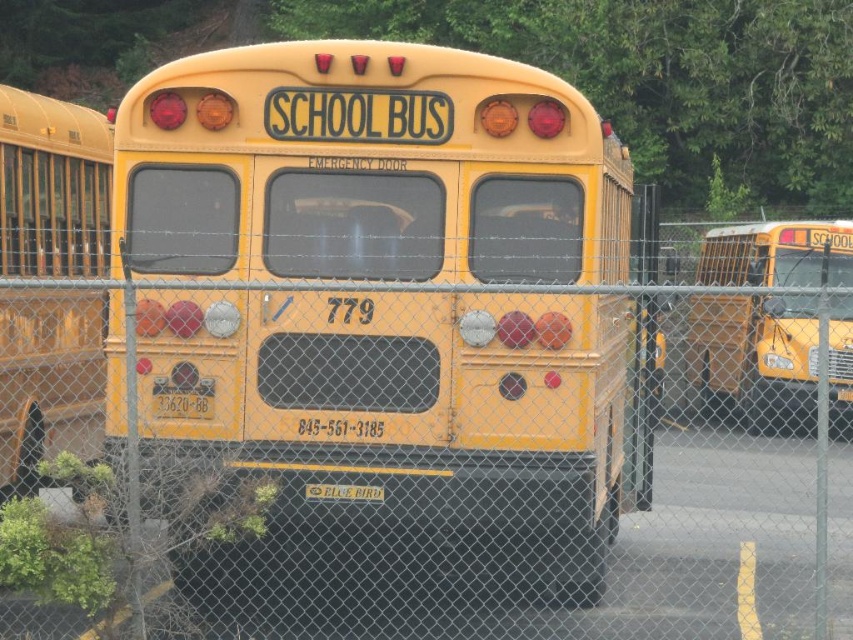
Question: Does metal chain-link fence at center come in front of yellow matte school bus at right?

Choices:
 (A) no
 (B) yes

Answer: (A)

Question: Which point is farther from the camera taking this photo?

Choices:
 (A) (15, 220)
 (B) (364, 250)
 (C) (338, 624)

Answer: (A)

Question: Which point is closer to the camera?

Choices:
 (A) yellow matte school bus at right
 (B) matte yellow school bus at left

Answer: (A)

Question: Which point is farther to the camera?

Choices:
 (A) (183, 321)
 (B) (96, 134)

Answer: (B)

Question: Is matte yellow school bus at left wider than yellow matte school bus at right?

Choices:
 (A) no
 (B) yes

Answer: (A)

Question: Is metal chain-link fence at center smaller than matte yellow school bus at left?

Choices:
 (A) no
 (B) yes

Answer: (A)